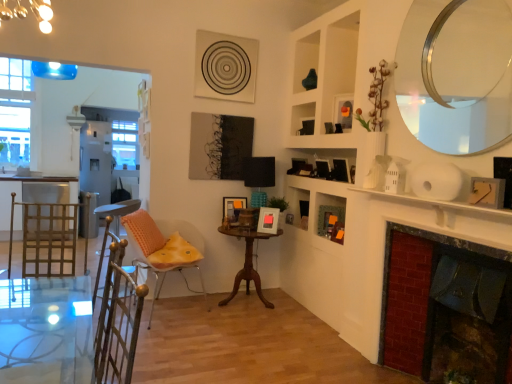
Question: In terms of height, does orange fabric chair at center look taller or shorter compared to wooden picture frame at upper right, the fourth picture frame positioned from the back?

Choices:
 (A) tall
 (B) short

Answer: (A)

Question: From a real-world perspective, is orange fabric chair at center physically located above or below wooden picture frame at upper right, placed as the fourth picture frame when sorted from left to right?

Choices:
 (A) below
 (B) above

Answer: (A)

Question: Which is nearer to the clear glass window at upper left?

Choices:
 (A) orange matte picture frame at upper center, placed as the 2th picture frame when sorted from right to left
 (B) transparent glass table at lower left
 (C) mahogany wood table at center
 (D) silver metallic mirror at upper right
 (E) wooden picture frame at upper right, marked as the 2th picture frame in a top-to-bottom arrangement

Answer: (C)

Question: Considering the real-world distances, which object is closest to the brick fireplace at right?

Choices:
 (A) transparent glass table at lower left
 (B) orange fabric chair at center
 (C) matte pink picture frame at center, placed as the first picture frame when sorted from bottom to top
 (D) white glossy screen door at left
 (E) clear glass window at upper left

Answer: (C)